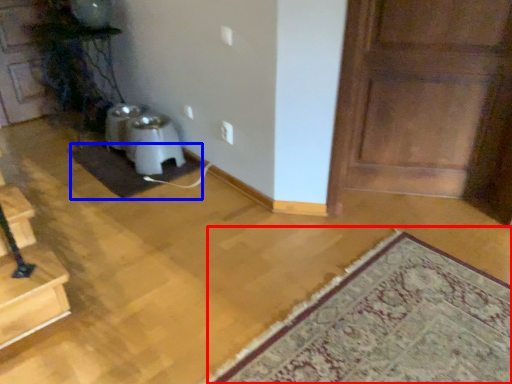
Question: Which of the following is the closest to the observer, mat (highlighted by a red box) or doormat (highlighted by a blue box)?

Choices:
 (A) mat
 (B) doormat

Answer: (A)